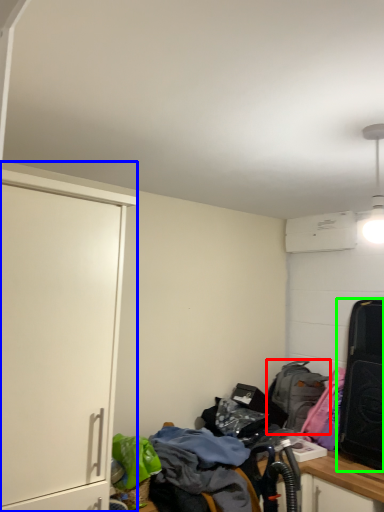
Question: Which is farther away from backpack (highlighted by a red box)? cabinetry (highlighted by a blue box) or luggage and bags (highlighted by a green box)?

Choices:
 (A) cabinetry
 (B) luggage and bags

Answer: (A)